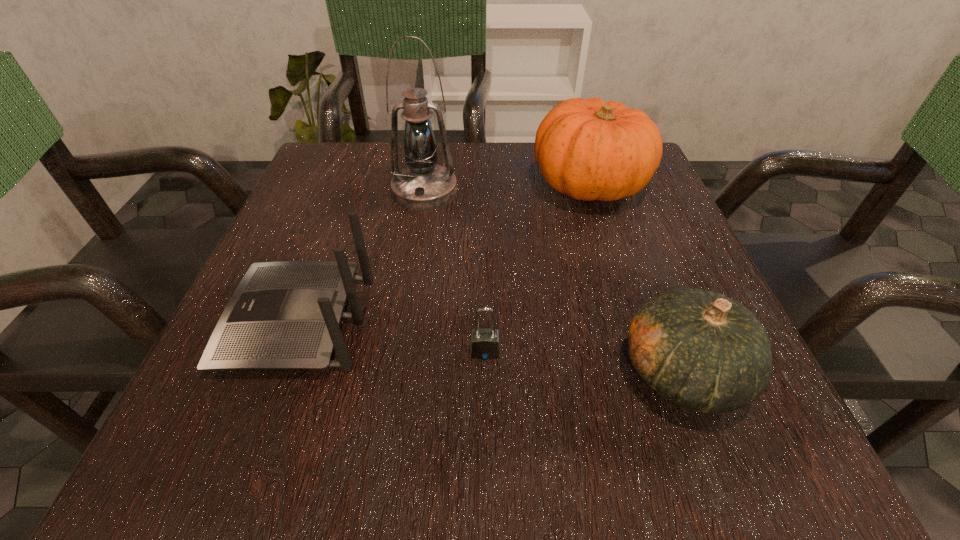
This screenshot has width=960, height=540. Identify the location of free space at the left edge. (204, 400).

In the image, there is a desktop. Find the location of `vacant space at the right edge`. vacant space at the right edge is located at coordinates (688, 282).

Find the location of a particular element. The image size is (960, 540). vacant space at the far left corner of the desktop is located at coordinates (372, 197).

This screenshot has width=960, height=540. I want to click on free region at the near left corner of the desktop, so click(x=214, y=421).

Identify the location of vacant area at the near right corner. (709, 467).

Image resolution: width=960 pixels, height=540 pixels. I want to click on empty space between the gourd and the oil lamp, so click(554, 282).

I want to click on free space that is in between the router and the third object from right to left, so click(392, 336).

The image size is (960, 540). Find the location of `free spot between the third object from left to right and the router`. free spot between the third object from left to right and the router is located at coordinates (392, 336).

The width and height of the screenshot is (960, 540). In order to click on free space between the router and the third object from left to right in this screenshot , I will do `click(392, 336)`.

I want to click on vacant area that lies between the shortest object and the router, so click(x=392, y=336).